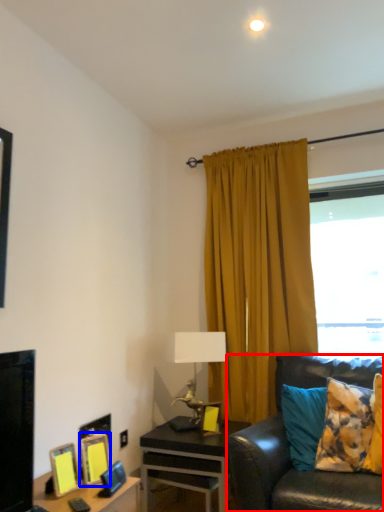
Question: Which object appears farthest to the camera in this image, studio couch (highlighted by a red box) or picture frame (highlighted by a blue box)?

Choices:
 (A) studio couch
 (B) picture frame

Answer: (B)